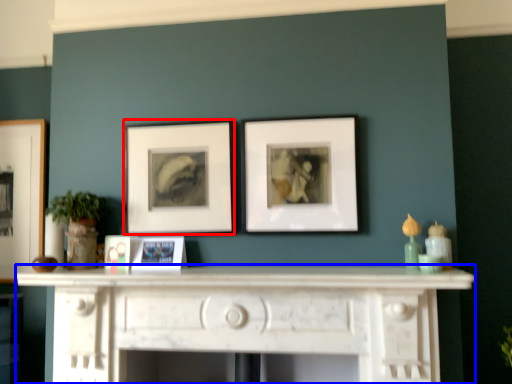
Question: Which of the following is the farthest to the observer, picture frame (highlighted by a red box) or table (highlighted by a blue box)?

Choices:
 (A) picture frame
 (B) table

Answer: (A)